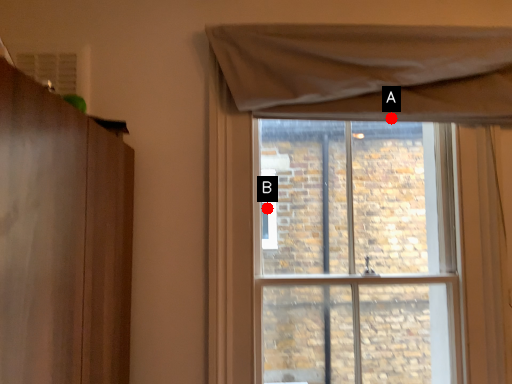
Question: Two points are circled on the image, labeled by A and B beside each circle. Which of the following is the farthest from the observer?

Choices:
 (A) A is further
 (B) B is further

Answer: (B)